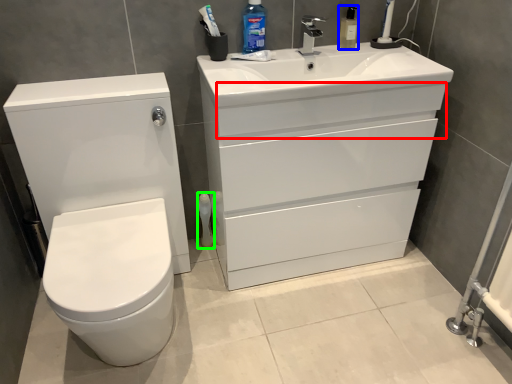
Question: Which object is the closest to the drawer (highlighted by a red box)? Choose among these: cleaning product (highlighted by a blue box) or toiletry (highlighted by a green box).

Choices:
 (A) cleaning product
 (B) toiletry

Answer: (A)